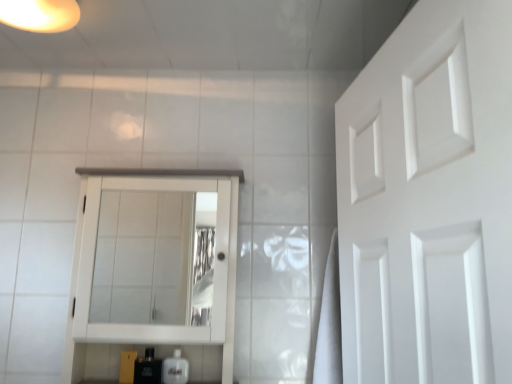
Question: Is translucent plastic soap at lower center, the 1th toiletry positioned from the right, not close to black glossy bottle at lower left, positioned as the 1th toiletry in left-to-right order?

Choices:
 (A) yes
 (B) no

Answer: (B)

Question: From a real-world perspective, is translucent plastic soap at lower center, the 2th toiletry viewed from the left, on black glossy bottle at lower left, positioned as the 1th toiletry in left-to-right order?

Choices:
 (A) no
 (B) yes

Answer: (B)

Question: Considering the relative positions of translucent plastic soap at lower center, the 1th toiletry positioned from the right, and black glossy bottle at lower left, positioned as the 1th toiletry in left-to-right order, in the image provided, is translucent plastic soap at lower center, the 1th toiletry positioned from the right, in front of black glossy bottle at lower left, positioned as the 1th toiletry in left-to-right order,?

Choices:
 (A) yes
 (B) no

Answer: (B)

Question: From the image's perspective, does translucent plastic soap at lower center, the 2th toiletry viewed from the left, appear higher than black glossy bottle at lower left, positioned as the 1th toiletry in left-to-right order?

Choices:
 (A) yes
 (B) no

Answer: (B)

Question: Does translucent plastic soap at lower center, the 2th toiletry viewed from the left, come behind black glossy bottle at lower left, which ranks as the second toiletry in right-to-left order?

Choices:
 (A) no
 (B) yes

Answer: (B)

Question: From a real-world perspective, is white wood medicine cabinet at center physically located above or below black glossy bottle at lower left, positioned as the 1th toiletry in left-to-right order?

Choices:
 (A) below
 (B) above

Answer: (B)

Question: Considering their positions, is white wood medicine cabinet at center located in front of or behind black glossy bottle at lower left, which ranks as the second toiletry in right-to-left order?

Choices:
 (A) behind
 (B) front

Answer: (B)

Question: Based on their sizes in the image, would you say white wood medicine cabinet at center is bigger or smaller than black glossy bottle at lower left, positioned as the 1th toiletry in left-to-right order?

Choices:
 (A) small
 (B) big

Answer: (B)

Question: Is white wood medicine cabinet at center taller or shorter than black glossy bottle at lower left, which ranks as the second toiletry in right-to-left order?

Choices:
 (A) tall
 (B) short

Answer: (A)

Question: Considering their positions, is white wood medicine cabinet at center located in front of or behind translucent plastic soap at lower center, the 2th toiletry viewed from the left?

Choices:
 (A) behind
 (B) front

Answer: (B)

Question: Is white wood medicine cabinet at center wider or thinner than translucent plastic soap at lower center, the 2th toiletry viewed from the left?

Choices:
 (A) thin
 (B) wide

Answer: (B)

Question: From the image's perspective, is white wood medicine cabinet at center above or below translucent plastic soap at lower center, the 1th toiletry positioned from the right?

Choices:
 (A) above
 (B) below

Answer: (A)

Question: Would you say white wood medicine cabinet at center is to the left or to the right of translucent plastic soap at lower center, the 2th toiletry viewed from the left, in the picture?

Choices:
 (A) left
 (B) right

Answer: (A)

Question: Relative to black glossy bottle at lower left, which ranks as the second toiletry in right-to-left order, is matte yellow light fixture at upper left in front or behind?

Choices:
 (A) front
 (B) behind

Answer: (A)

Question: Looking at the image, does matte yellow light fixture at upper left seem bigger or smaller compared to black glossy bottle at lower left, which ranks as the second toiletry in right-to-left order?

Choices:
 (A) small
 (B) big

Answer: (B)